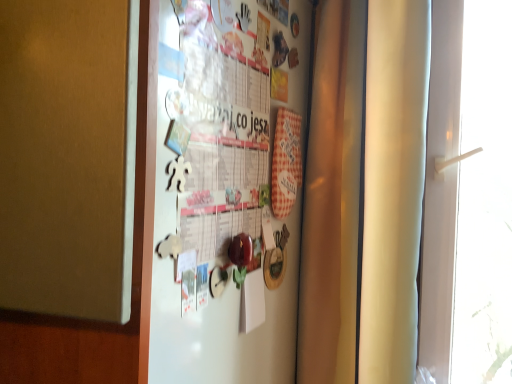
Question: Looking at the image, does white plastic handle at right seem bigger or smaller compared to white paperboard fridge at center?

Choices:
 (A) big
 (B) small

Answer: (A)

Question: Visually, is white plastic handle at right positioned to the left or to the right of white paperboard fridge at center?

Choices:
 (A) left
 (B) right

Answer: (B)

Question: Is white plastic handle at right situated inside white paperboard fridge at center or outside?

Choices:
 (A) outside
 (B) inside

Answer: (A)

Question: Based on their positions, is white paperboard fridge at center located to the left or right of white plastic handle at right?

Choices:
 (A) left
 (B) right

Answer: (A)

Question: From a real-world perspective, is white paperboard fridge at center positioned above or below white plastic handle at right?

Choices:
 (A) below
 (B) above

Answer: (B)

Question: Is white paperboard fridge at center in front of or behind white plastic handle at right in the image?

Choices:
 (A) behind
 (B) front

Answer: (B)

Question: From the image's perspective, is white paperboard fridge at center above or below white plastic handle at right?

Choices:
 (A) above
 (B) below

Answer: (A)